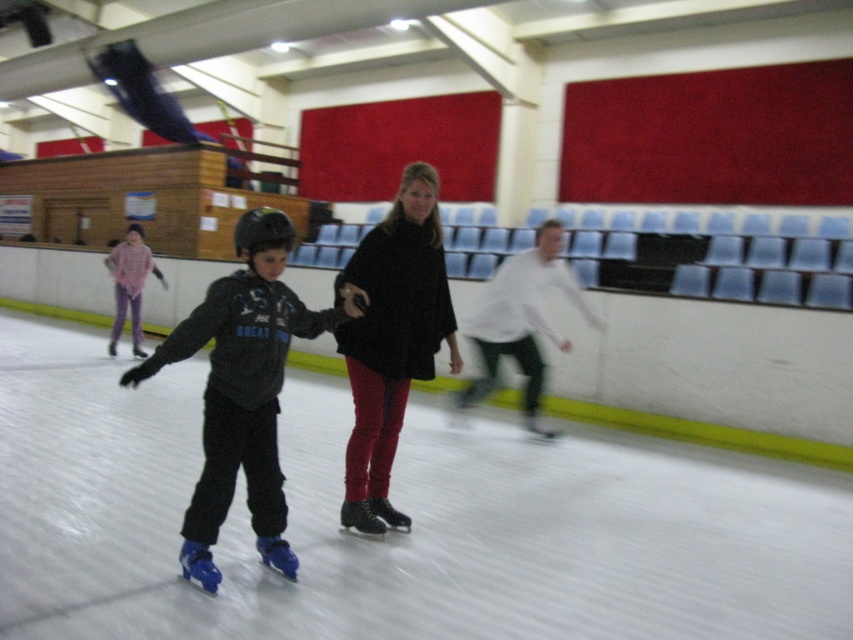
Does black matte/black fabric at center have a smaller size compared to plush pink sweater at left?

Yes.

Between black matte/black fabric at center and plush pink sweater at left, which one has less height?

With less height is plush pink sweater at left.

Find the location of a particular element. This screenshot has height=640, width=853. black matte/black fabric at center is located at coordinates (392, 340).

Is point (223, 493) less distant than point (143, 352)?

That is True.

Who is more distant from viewer, (215, 448) or (112, 348)?

The point (112, 348) is more distant.

Where is `matte blue roller skates at center`? The height and width of the screenshot is (640, 853). matte blue roller skates at center is located at coordinates (242, 388).

Does black matte/black fabric at center have a smaller size compared to white matte jacket at center?

Indeed, black matte/black fabric at center has a smaller size compared to white matte jacket at center.

Can you confirm if black matte/black fabric at center is positioned to the left of white matte jacket at center?

Indeed, black matte/black fabric at center is positioned on the left side of white matte jacket at center.

Between point (357, 404) and point (523, 301), which one is positioned behind?

Positioned behind is point (523, 301).

Where is `black matte/black fabric at center`? The image size is (853, 640). black matte/black fabric at center is located at coordinates coord(392,340).